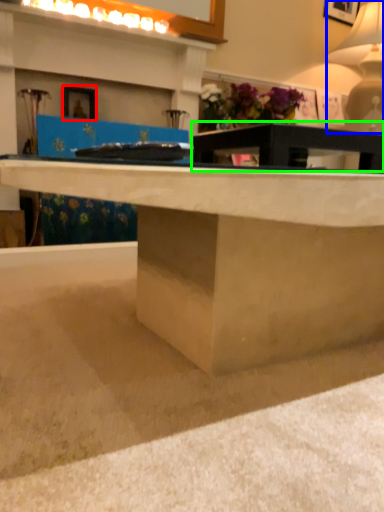
Question: Which is farther away from picture frame (highlighted by a red box)? table lamp (highlighted by a blue box) or table (highlighted by a green box)?

Choices:
 (A) table lamp
 (B) table

Answer: (A)